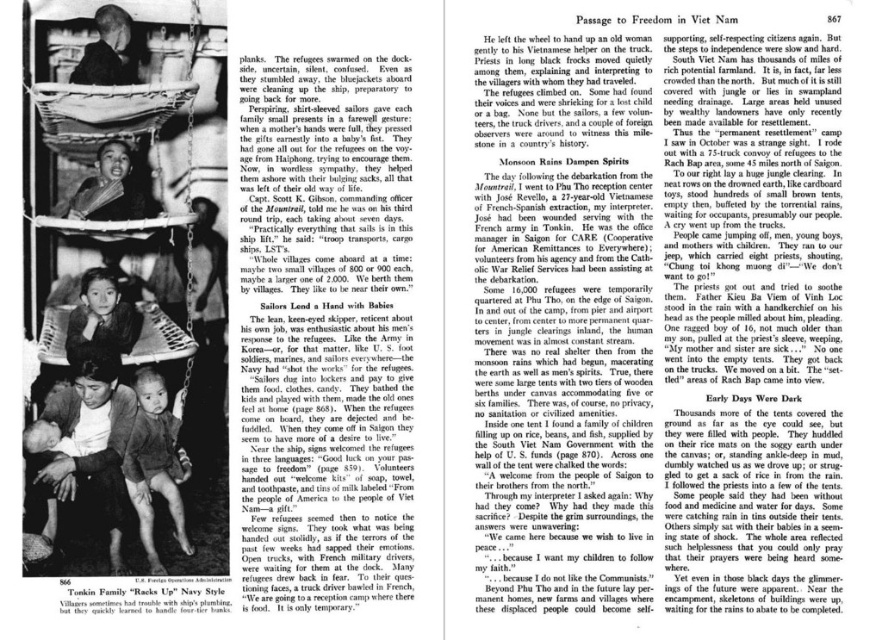
Question: Does white paper at upper center appear under matte brown fabric baby at center?

Choices:
 (A) no
 (B) yes

Answer: (A)

Question: Which point appears closest to the camera in this image?

Choices:
 (A) (87, 51)
 (B) (146, 600)
 (C) (117, 360)

Answer: (B)

Question: Which object appears farthest from the camera in this image?

Choices:
 (A) matte black baby at center
 (B) brushed metal water at bottle left
 (C) white paper at upper center

Answer: (A)

Question: Estimate the real-world distances between objects in this image. Which object is farther from the light brown skin at center?

Choices:
 (A) matte black laptop at center
 (B) black hair at center
 (C) brushed metal water at bottle left

Answer: (A)

Question: Does matte black laptop at center come in front of matte black baby at center?

Choices:
 (A) no
 (B) yes

Answer: (B)

Question: Is matte black laptop at center wider than matte brown fabric baby at center?

Choices:
 (A) no
 (B) yes

Answer: (B)